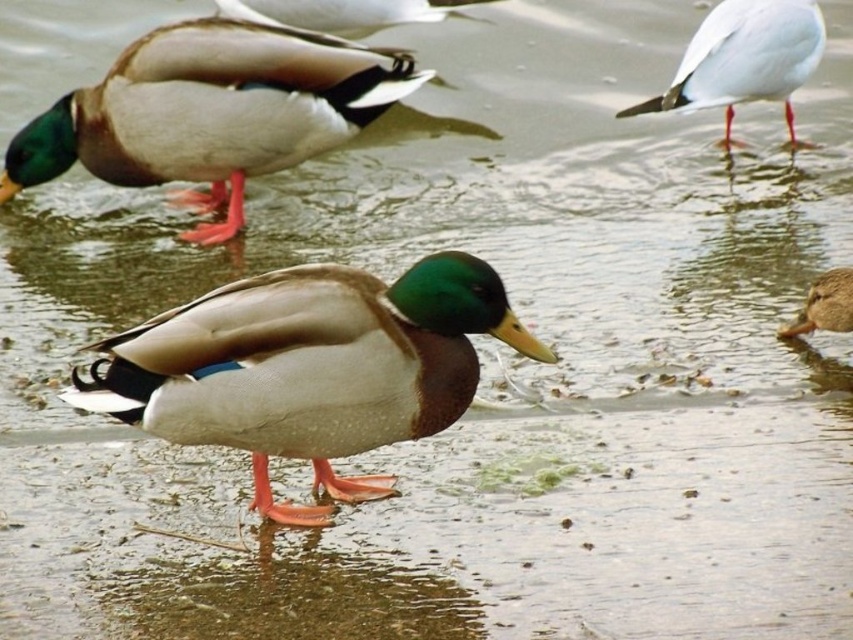
You are standing at the point marked as point [86,388] and want to throw a stone to reach the viewer who is 3.08 meters away. Is the distance within your throwing range if your maximum throw is 3 meters?

The distance between point [86,388] and the viewer is 3.08 meters, which exceeds your maximum throwing range of 3 meters. Therefore, you cannot reach the viewer with a single throw.

You are a wildlife photographer aiming to capture a closeup shot of the shiny brown duck at upper left. Based on its coordinates, where should you aim your camera?

The shiny brown duck at upper left is located at coordinates point (x=212, y=112), so aim your camera at that position.

You are a wildlife photographer aiming to capture a closeup shot of the matte brown duck at center and the white matte seagull at upper right. Given that your camera lens has a maximum focus range of 2 meters, can you determine which of the two birds is within the focus range based on their sizes?

The matte brown duck at center is smaller in size compared to the white matte seagull at upper right. Since the focus range depends on the distance from the camera, the size difference alone does not indicate their distance. Therefore, it is impossible to determine which bird is within the 2 meter focus range based solely on their sizes.